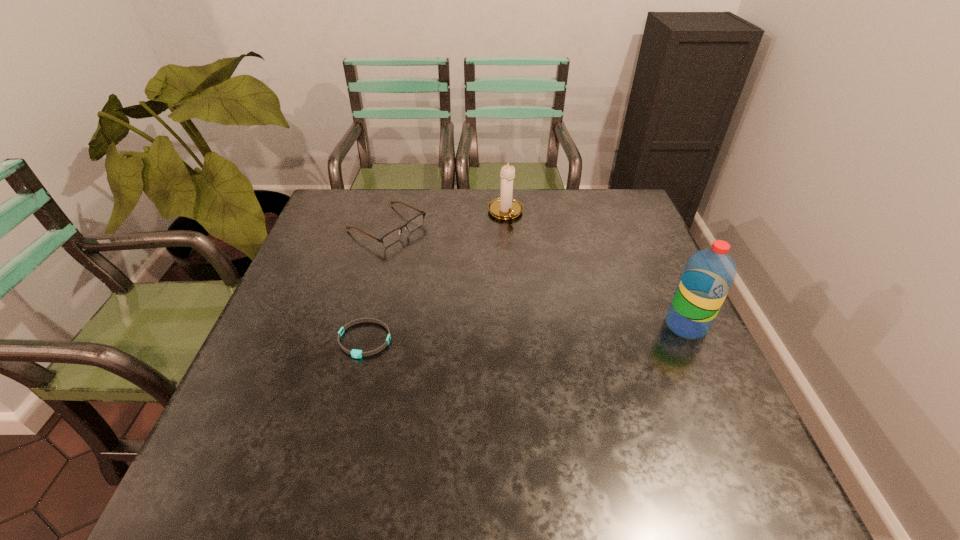
Where is `wristband`? Image resolution: width=960 pixels, height=540 pixels. wristband is located at coordinates (355, 353).

Find the location of `water bottle`. water bottle is located at coordinates (709, 274).

The image size is (960, 540). I want to click on the rightmost object, so click(x=709, y=274).

Where is `spectacles`? The image size is (960, 540). spectacles is located at coordinates (394, 235).

The width and height of the screenshot is (960, 540). Find the location of `candle holder`. candle holder is located at coordinates (505, 207).

The width and height of the screenshot is (960, 540). In order to click on the second tallest object in this screenshot , I will do `click(505, 207)`.

Identify the location of free spot located 0.090m on the buckle of the shortest object. (350, 395).

This screenshot has height=540, width=960. What are the coordinates of `vacant space situated 0.350m on the front-facing side of the spectacles` in the screenshot? It's located at (512, 295).

Locate an element on the screen. This screenshot has width=960, height=540. free space located on the front-facing side of the spectacles is located at coordinates (464, 269).

Find the location of a particular element. The image size is (960, 540). vacant space situated 0.240m on the front-facing side of the spectacles is located at coordinates (478, 277).